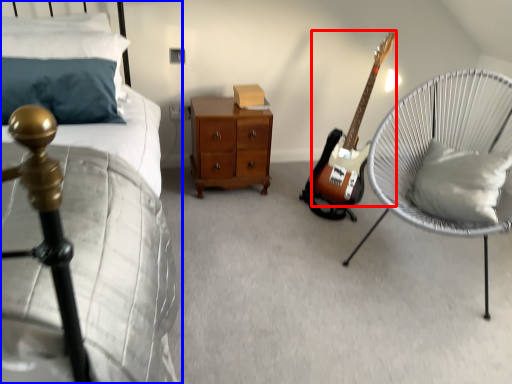
Question: Which of the following is the farthest to the observer, guitar (highlighted by a red box) or bed (highlighted by a blue box)?

Choices:
 (A) guitar
 (B) bed

Answer: (A)